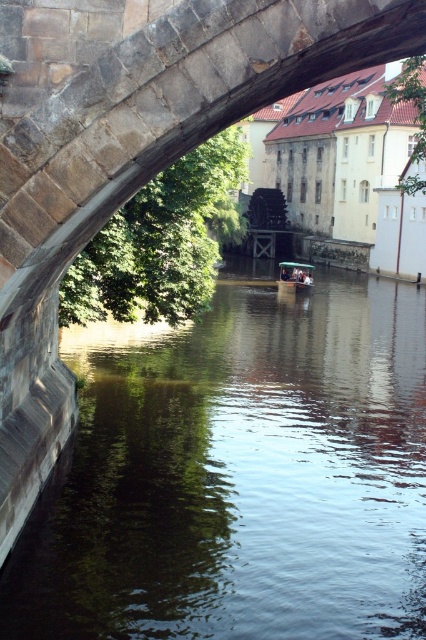
You are standing on the stone bridge arch in the upper left and want to reach the wooden boat at center. Which direction should you head towards from the dark green water at center?

The dark green water at center is to the left of the wooden boat at center, so you should head towards the right from the dark green water at center to reach the wooden boat at center.

You are standing at the point marked as point [356,612] in this riverside scene. A friend is standing exactly where you are viewing from. How far apart are you and your friend?

The distance between point [356,612] and the viewer is 8.89 meters, so you and your friend are 8.89 meters apart.

You are standing at the center of the stone bridge arch in the upper left. You want to locate the dark green water at center. In which direction should you look relative to your position?

The dark green water at center is located at point (x=238, y=476) in 2D coordinates, so you should look to your lower right direction from your position at the center of the stone bridge arch in the upper left.